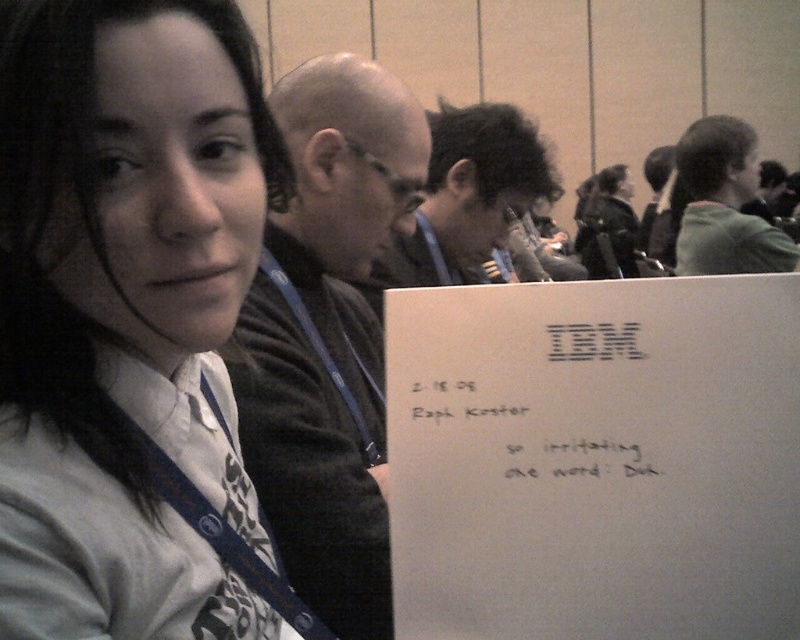
You are standing in the conference room and need to determine which of the two points, point (392, 172) or point (714, 225), is closer to you. Based on the image, which one is nearer?

Point (392, 172) is closer to the camera than point (714, 225), so it is the nearer one.